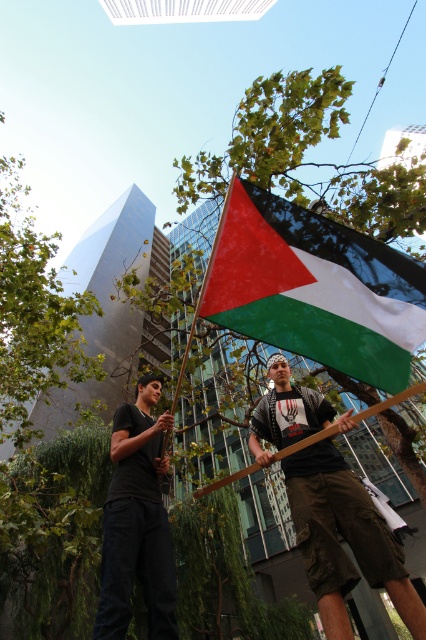
How far apart are polyester flag at center and matte black t-shirt at center?

polyester flag at center and matte black t-shirt at center are 3.62 feet apart from each other.

Does polyester flag at center appear under matte black t-shirt at center?

Actually, polyester flag at center is above matte black t-shirt at center.

This screenshot has height=640, width=426. I want to click on polyester flag at center, so point(313,288).

Does matte black t-shirt at center appear on the left side of black matte shirt at center?

No, matte black t-shirt at center is not to the left of black matte shirt at center.

Is matte black t-shirt at center bigger than black matte shirt at center?

Correct, matte black t-shirt at center is larger in size than black matte shirt at center.

Measure the distance between point (293, 387) and camera.

Point (293, 387) is 3.66 meters away from camera.

Locate an element on the screen. The width and height of the screenshot is (426, 640). matte black t-shirt at center is located at coordinates (344, 538).

Measure the distance from polyester flag at center to black matte shirt at center.

polyester flag at center and black matte shirt at center are 1.39 meters apart from each other.

The image size is (426, 640). What do you see at coordinates (313, 288) in the screenshot?
I see `polyester flag at center` at bounding box center [313, 288].

Where is `polyester flag at center`? The image size is (426, 640). polyester flag at center is located at coordinates (313, 288).

You are a GUI agent. You are given a task and a screenshot of the screen. Output one action in this format:
    pyautogui.click(x=<x>, y=<y>)
    Task: Click on the polyester flag at center
    This screenshot has width=426, height=640.
    Given the screenshot: What is the action you would take?
    pyautogui.click(x=313, y=288)